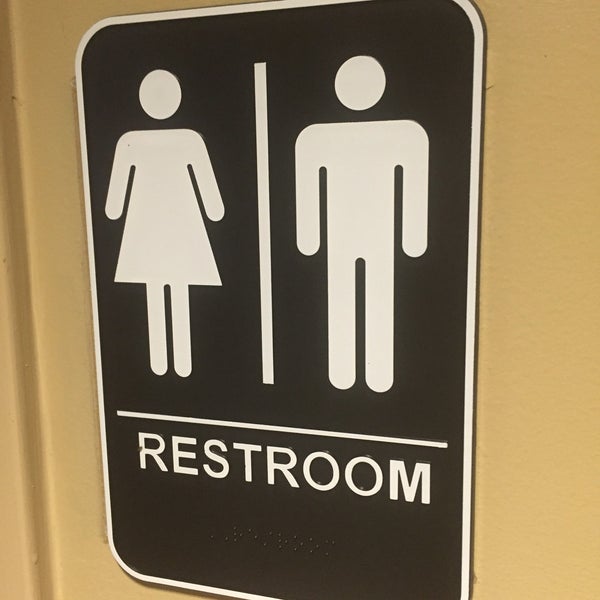
Find the location of a particular element. The height and width of the screenshot is (600, 600). wall is located at coordinates pyautogui.click(x=518, y=87).